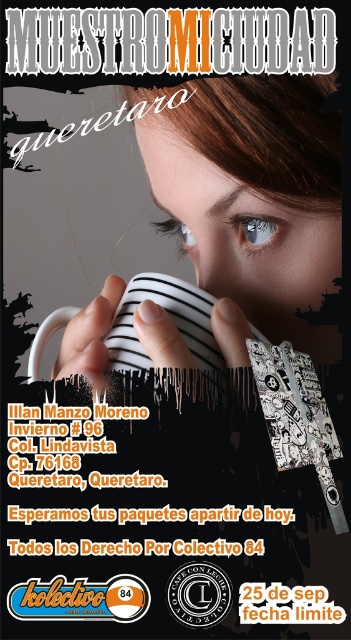
Does white striped mug at center have a smaller size compared to blue glass eye at center?

Actually, white striped mug at center might be larger than blue glass eye at center.

Can you confirm if white striped mug at center is positioned above blue glass eye at center?

No, white striped mug at center is not above blue glass eye at center.

This screenshot has height=640, width=351. I want to click on white striped mug at center, so click(x=168, y=316).

At what (x,y) coordinates should I click in order to perform the action: click on white striped mug at center. Please return your answer as a coordinate pair (x, y). The width and height of the screenshot is (351, 640). Looking at the image, I should click on (168, 316).

Can you confirm if blue glass eye at center is bigger than blue glossy eye at upper center?

Actually, blue glass eye at center might be smaller than blue glossy eye at upper center.

I want to click on blue glass eye at center, so click(x=255, y=228).

Measure the distance between white striped mug at center and camera.

white striped mug at center is 37.44 centimeters from camera.

Which is in front, point (60, 323) or point (186, 248)?

Point (60, 323) is in front.

Locate an element on the screen. This screenshot has height=640, width=351. white striped mug at center is located at coordinates (168, 316).